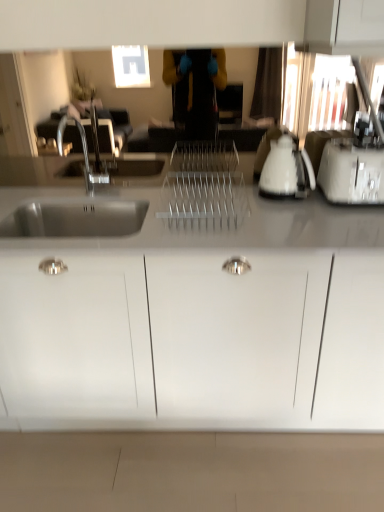
Where is `free spot in front of white plastic toaster at right`? Image resolution: width=384 pixels, height=512 pixels. free spot in front of white plastic toaster at right is located at coordinates (347, 223).